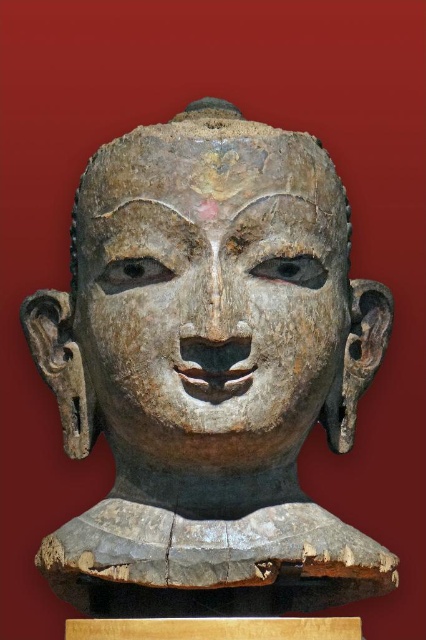
Between point (176, 154) and point (167, 131), which one is positioned behind?

Positioned behind is point (167, 131).

Measure the distance from weathered wood head at center to weathered wood face at center.

weathered wood head at center is 1.03 inches away from weathered wood face at center.

Is point (129, 531) closer to viewer compared to point (290, 300)?

Yes, it is in front of point (290, 300).

This screenshot has width=426, height=640. I want to click on weathered wood head at center, so click(210, 371).